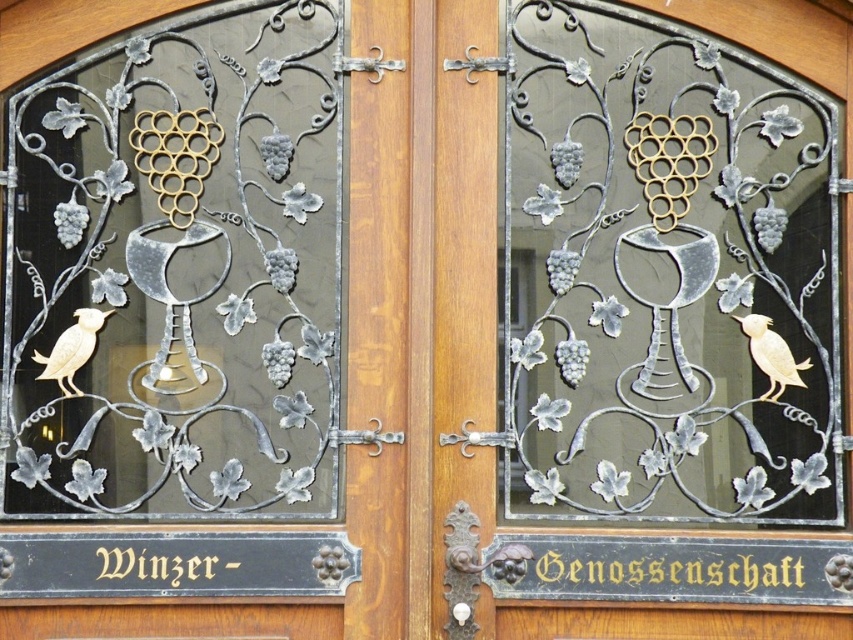
Question: Which point is farther to the camera?

Choices:
 (A) gold metallic bird at left
 (B) metallic silver chalice at center

Answer: (A)

Question: Can you confirm if metallic silver chalice at center is positioned to the left of gold metallic bird at left?

Choices:
 (A) no
 (B) yes

Answer: (A)

Question: Which object is closer to the camera taking this photo?

Choices:
 (A) gold matte bird at right
 (B) matte silver chalice at center

Answer: (B)

Question: Does metallic silver chalice at center have a smaller size compared to matte silver chalice at center?

Choices:
 (A) yes
 (B) no

Answer: (A)

Question: Is metallic silver chalice at center thinner than gold metallic bird at left?

Choices:
 (A) yes
 (B) no

Answer: (B)

Question: Among these objects, which one is farthest from the camera?

Choices:
 (A) metallic silver chalice at center
 (B) gold matte bird at right
 (C) gold metallic bird at left
 (D) matte silver chalice at center

Answer: (B)